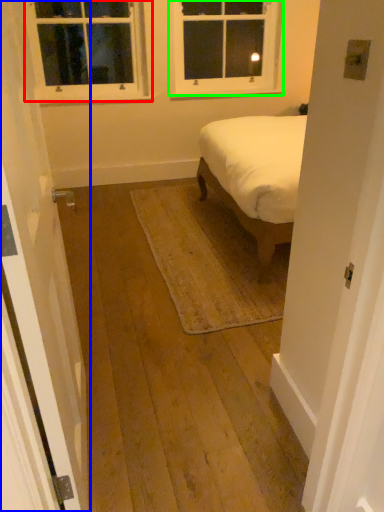
Question: Which object is the farthest from window (highlighted by a red box)? Choose among these: door (highlighted by a blue box) or window (highlighted by a green box).

Choices:
 (A) door
 (B) window

Answer: (A)